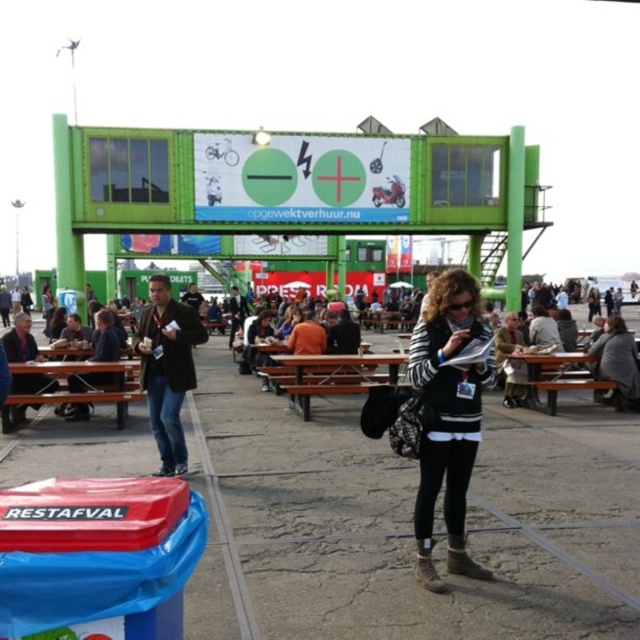
Is point (435, 340) closer to viewer compared to point (132, 390)?

Yes.

Consider the image. Between black textured jacket at center and brown wooden picnic table at lower left, which one is positioned higher?

Positioned higher is black textured jacket at center.

Is point (456, 284) closer to viewer compared to point (26, 364)?

That is True.

The image size is (640, 640). I want to click on black textured jacket at center, so click(449, 416).

Between point (156, 308) and point (289, 380), which one is positioned in front?

Positioned in front is point (156, 308).

Which of these two, dark brown leather jacket at center or brown wooden bench at center, stands shorter?

With less height is brown wooden bench at center.

This screenshot has width=640, height=640. Describe the element at coordinates (168, 369) in the screenshot. I see `dark brown leather jacket at center` at that location.

Locate an element on the screen. Image resolution: width=640 pixels, height=640 pixels. dark brown leather jacket at center is located at coordinates (168, 369).

From the picture: Can you confirm if black textured jacket at center is positioned to the right of brown wooden picnic table at lower right?

Incorrect, black textured jacket at center is not on the right side of brown wooden picnic table at lower right.

Between point (440, 276) and point (582, 358), which one is positioned behind?

The point (582, 358) is behind.

Where is `black textured jacket at center`? The image size is (640, 640). black textured jacket at center is located at coordinates (449, 416).